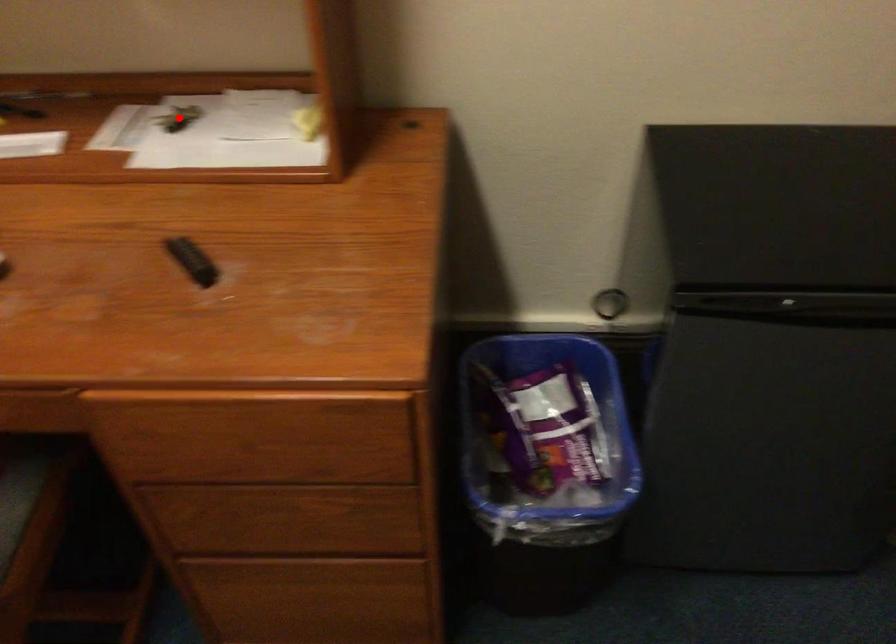
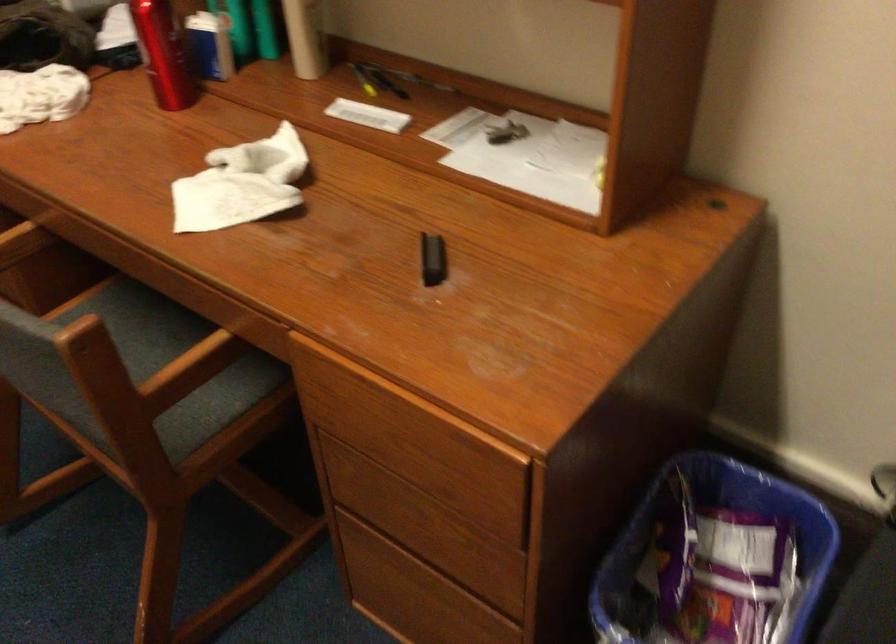
In the second image, find the point that corresponds to the highlighted location in the first image.

(504, 131)